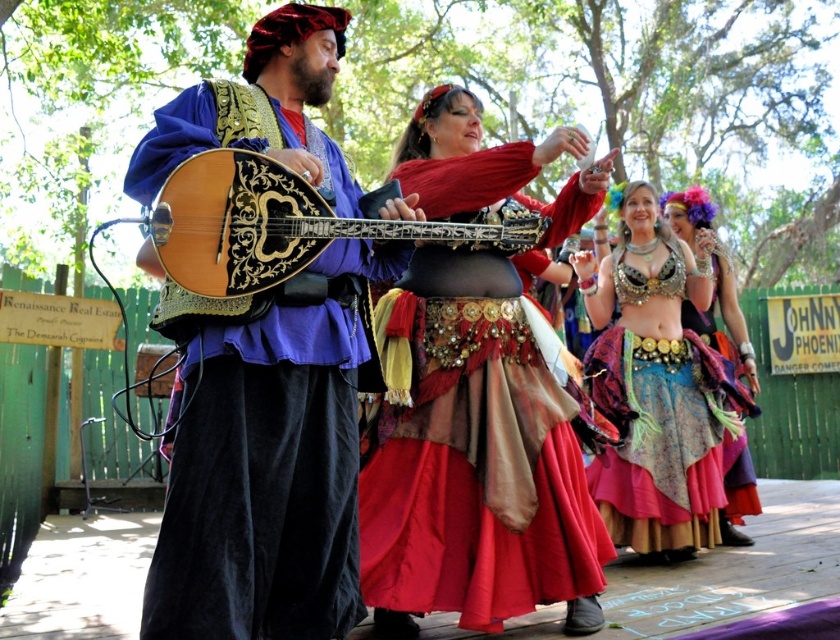
You are an event photographer at the Renaissance fair. You need to capture a photo that includes both the velvet blue tunic at center and the multicolored fabric skirt at right. Based on their positions, which object should appear closer to the camera in the photo?

The velvet blue tunic at center should appear closer to the camera because it is in front of the multicolored fabric skirt at right.

You are a guest at the Renaissance fair and want to take a photo of the velvet blue tunic at center and the multicolored fabric skirt at right. Which object should you position closer to the left side of your camera frame to include both in the shot?

You should position the velvet blue tunic at center closer to the left side of your camera frame since it is already to the left of the multicolored fabric skirt at right.

You are an attendee at the Renaissance fair and want to take a photo of the wooden glossy mandolin at center and the multicolored fabric skirt at right. Which object should you focus on first to ensure both are in clear view?

You should focus on the wooden glossy mandolin at center first because it is closer to the viewer than the multicolored fabric skirt at right, so adjusting focus starting from the closer object will help both be in clear view.